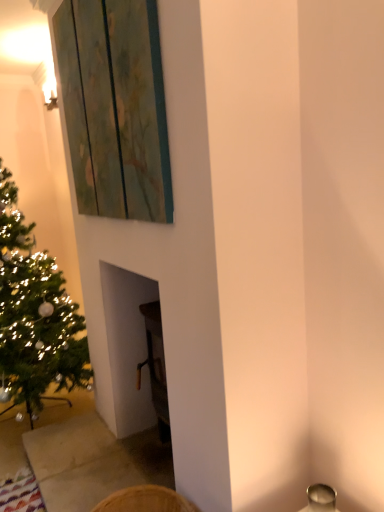
Where is `green matte christmas tree at left`? This screenshot has height=512, width=384. green matte christmas tree at left is located at coordinates (35, 315).

What is the approximate width of green matte christmas tree at left?

green matte christmas tree at left is 22.23 inches in width.

Describe the element at coordinates (35, 315) in the screenshot. I see `green matte christmas tree at left` at that location.

Locate an element on the screen. green matte christmas tree at left is located at coordinates (35, 315).